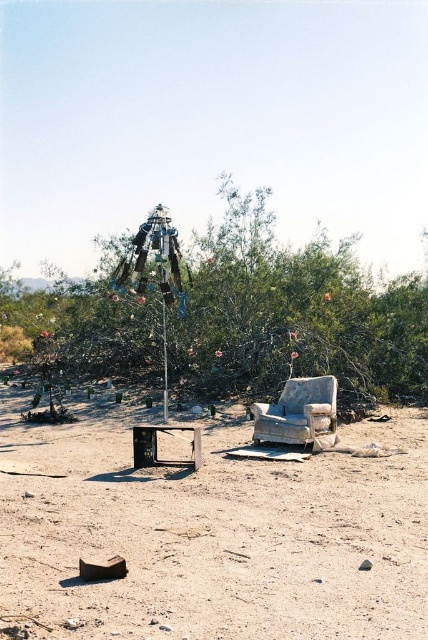
Question: Which object is positioned farthest from the dusty brown dirt at center?

Choices:
 (A) green leafy tree at center
 (B) worn fabric armchair at center
 (C) metallic pole at center
 (D) metallic silver tv at center

Answer: (A)

Question: Can you confirm if green leafy tree at center is smaller than metallic pole at center?

Choices:
 (A) no
 (B) yes

Answer: (A)

Question: Does green leafy tree at center come behind metallic pole at center?

Choices:
 (A) no
 (B) yes

Answer: (B)

Question: Among these objects, which one is farthest from the camera?

Choices:
 (A) worn fabric armchair at center
 (B) metallic pole at center

Answer: (B)

Question: Does green leafy tree at center appear under worn fabric armchair at center?

Choices:
 (A) yes
 (B) no

Answer: (B)

Question: Which of the following is the closest to the observer?

Choices:
 (A) (163, 400)
 (B) (201, 461)

Answer: (B)